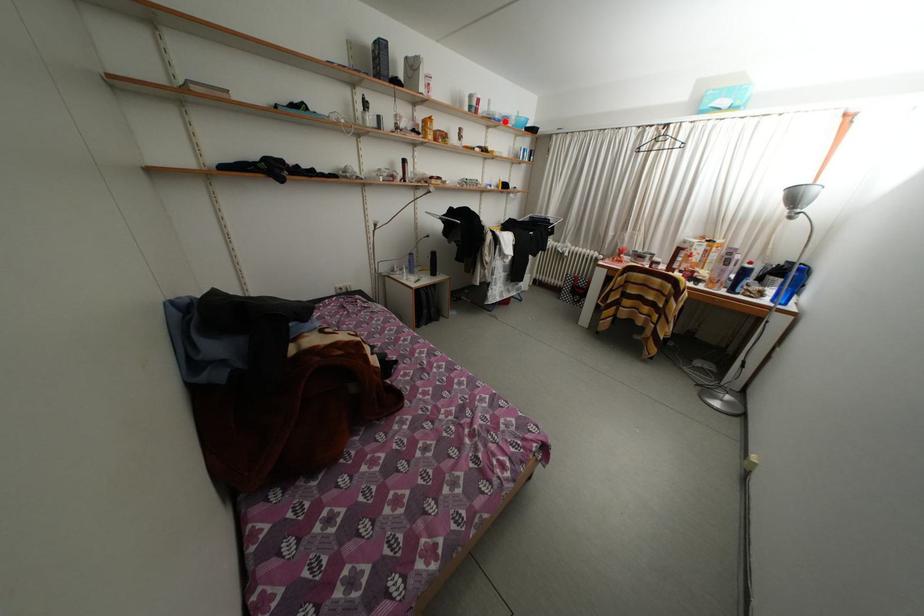
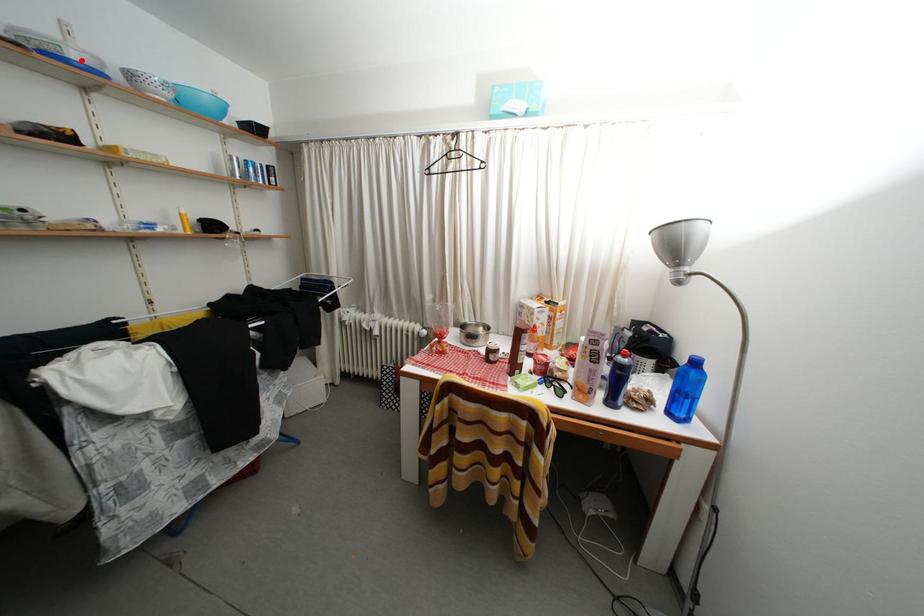
I am providing you with two images of the same scene from different viewpoints. A red point is marked on the first image and another point is marked on the second image. Are the points marked in image1 and image2 representing the same 3D position?

Yes